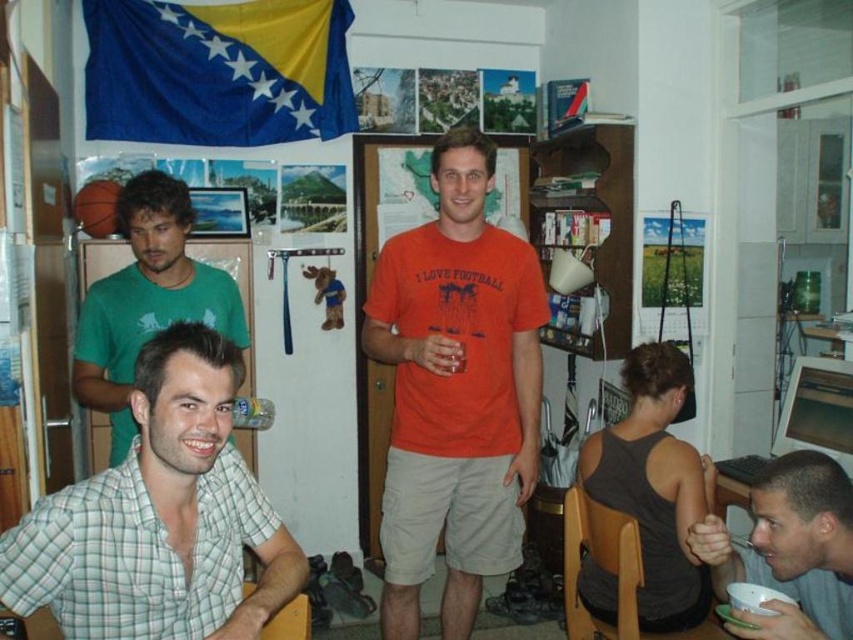
Is point (370, 276) more distant than point (447, 371)?

Yes, it is.

Can you confirm if orange cotton t-shirt at center is positioned to the left of translucent plastic cup at center?

In fact, orange cotton t-shirt at center is to the right of translucent plastic cup at center.

What do you see at coordinates (456, 392) in the screenshot? I see `orange cotton t-shirt at center` at bounding box center [456, 392].

I want to click on orange cotton t-shirt at center, so click(x=456, y=392).

Between point (204, 374) and point (132, 220), which one is positioned behind?

The point (132, 220) is behind.

Who is lower down, green checkered shirt at left or green matte t-shirt at upper left?

green checkered shirt at left is lower down.

Which is in front, point (80, 509) or point (138, 316)?

Point (80, 509) is more forward.

Identify the location of green checkered shirt at left. Image resolution: width=853 pixels, height=640 pixels. (160, 516).

Is point (509, 324) positioned before point (793, 513)?

That is False.

Locate an element on the screen. The width and height of the screenshot is (853, 640). orange cotton t-shirt at center is located at coordinates (456, 392).

The width and height of the screenshot is (853, 640). Identify the location of orange cotton t-shirt at center. (456, 392).